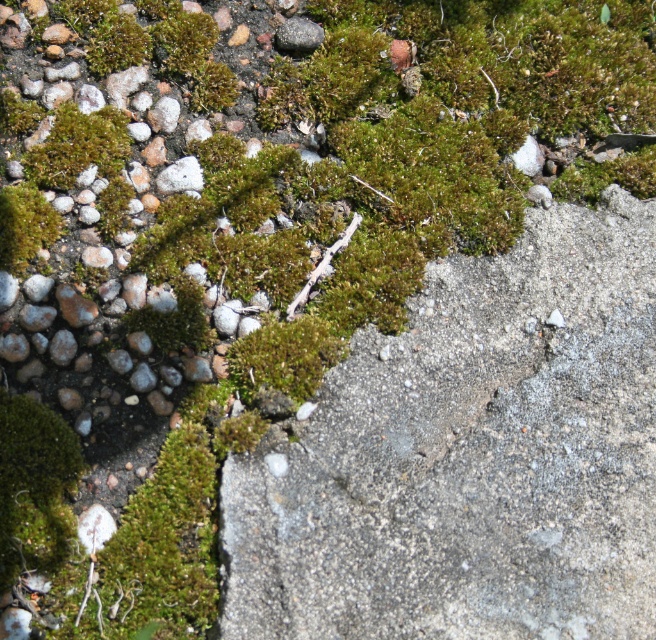
Where is `gray concrete at center`? gray concrete at center is located at coordinates (470, 456).

Which is more to the left, gray concrete at center or green mossy patch at upper left?

green mossy patch at upper left

At what (x,y) coordinates should I click in order to perform the action: click on gray concrete at center. Please return your answer as a coordinate pair (x, y). The height and width of the screenshot is (640, 656). Looking at the image, I should click on (470, 456).

Where is `gray concrete at center`? gray concrete at center is located at coordinates (470, 456).